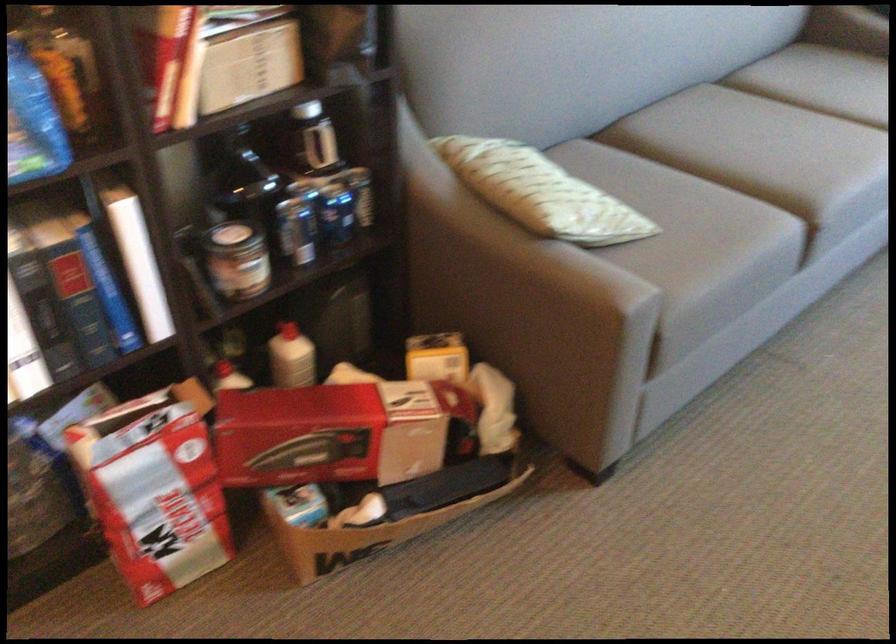
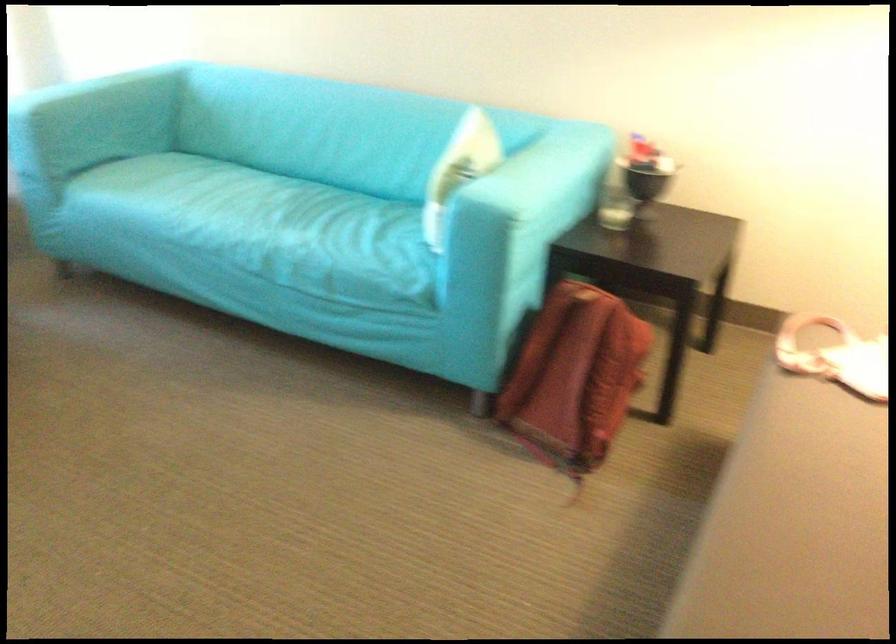
How did the camera likely rotate?

The rotation direction of the camera is right-down.